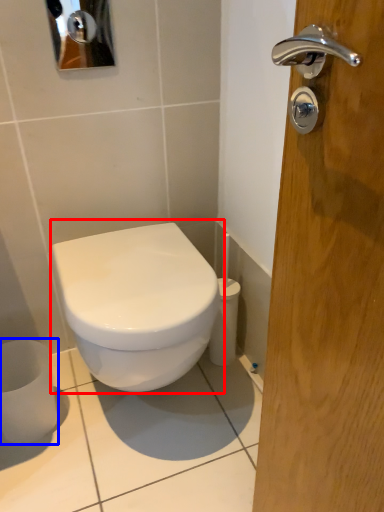
Question: Among these objects, which one is nearest to the camera, toilet (highlighted by a red box) or toilet paper (highlighted by a blue box)?

Choices:
 (A) toilet
 (B) toilet paper

Answer: (A)